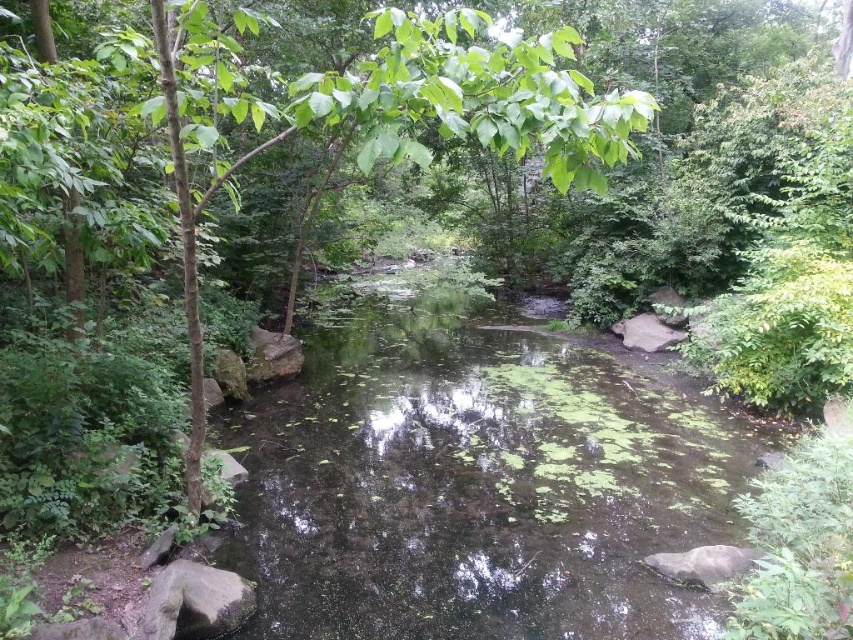
You are standing at the edge of the stream and notice a point in the water labeled as point (474, 484). What is located at that specific point?

At point (474, 484) lies green algae covered water at center.